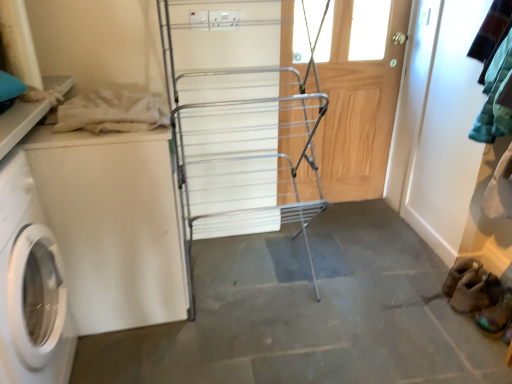
Question: From a real-world perspective, is gray concrete floor at center physically above brown suede shoe at lower right, the 1th shoe in the front-to-back sequence?

Choices:
 (A) yes
 (B) no

Answer: (B)

Question: Does gray concrete floor at center have a greater height compared to brown suede shoe at lower right, the 1th shoe in the front-to-back sequence?

Choices:
 (A) no
 (B) yes

Answer: (A)

Question: Can you confirm if gray concrete floor at center is shorter than brown suede shoe at lower right, the 1th shoe in the front-to-back sequence?

Choices:
 (A) no
 (B) yes

Answer: (B)

Question: Is gray concrete floor at center oriented towards brown suede shoe at lower right, the 1th shoe in the front-to-back sequence?

Choices:
 (A) no
 (B) yes

Answer: (A)

Question: Does gray concrete floor at center have a lesser width compared to brown suede shoe at lower right, which ranks as the second shoe in back-to-front order?

Choices:
 (A) yes
 (B) no

Answer: (B)

Question: Is gray concrete floor at center turned away from brown suede shoe at lower right, the 1th shoe in the front-to-back sequence?

Choices:
 (A) no
 (B) yes

Answer: (A)

Question: Is beige cotton cloth at upper left completely or partially outside of white matte washing machine at left, which is the first washing machine from right to left?

Choices:
 (A) yes
 (B) no

Answer: (A)

Question: From a real-world perspective, is beige cotton cloth at upper left located higher than white matte washing machine at left, which is the second washing machine from left to right?

Choices:
 (A) yes
 (B) no

Answer: (A)

Question: Is the position of beige cotton cloth at upper left less distant than that of white matte washing machine at left, which is the second washing machine from left to right?

Choices:
 (A) no
 (B) yes

Answer: (B)

Question: From a real-world perspective, is beige cotton cloth at upper left positioned under white matte washing machine at left, which is the second washing machine from left to right, based on gravity?

Choices:
 (A) no
 (B) yes

Answer: (A)

Question: Is beige cotton cloth at upper left not close to white matte washing machine at left, which is the first washing machine from right to left?

Choices:
 (A) yes
 (B) no

Answer: (B)

Question: Is beige cotton cloth at upper left taller than white matte washing machine at left, which is the second washing machine from left to right?

Choices:
 (A) no
 (B) yes

Answer: (A)

Question: Considering the relative sizes of wooden screen door at center and white matte washing machine at left, which is the second washing machine from left to right, in the image provided, is wooden screen door at center wider than white matte washing machine at left, which is the second washing machine from left to right,?

Choices:
 (A) yes
 (B) no

Answer: (B)